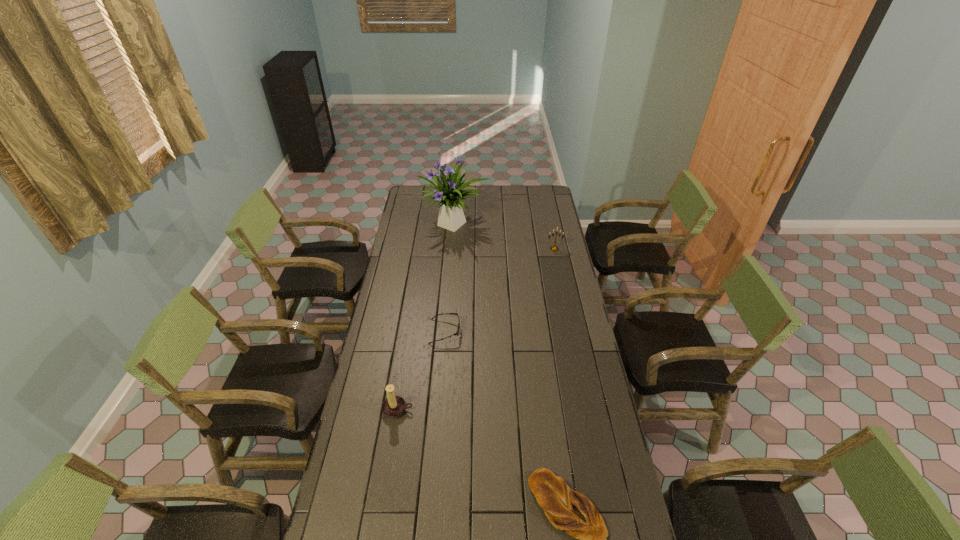
Where is `flower arrangement`? The image size is (960, 540). flower arrangement is located at coordinates (450, 192).

Locate an element on the screen. the second nearest object is located at coordinates (393, 406).

In order to click on the nearer candelabrum in this screenshot , I will do `click(393, 406)`.

Locate an element on the screen. Image resolution: width=960 pixels, height=540 pixels. the farther candelabrum is located at coordinates (553, 248).

The width and height of the screenshot is (960, 540). What are the coordinates of `sunglasses` in the screenshot? It's located at (458, 330).

Identify the location of vacant position located 0.080m on the front of the tallest object. The height and width of the screenshot is (540, 960). (453, 255).

You are a GUI agent. You are given a task and a screenshot of the screen. Output one action in this format:
    pyautogui.click(x=<x>, y=<y>)
    Task: Click on the free location located 0.350m on the wick of the second nearest object
    This screenshot has height=540, width=960.
    Given the screenshot: What is the action you would take?
    pyautogui.click(x=380, y=524)

Find the location of a particular element. This screenshot has width=960, height=540. vacant region located on the front of the farther candelabrum is located at coordinates (557, 260).

Locate an element on the screen. This screenshot has height=540, width=960. vacant area situated 0.110m on the front-facing side of the sunglasses is located at coordinates (485, 332).

You are a GUI agent. You are given a task and a screenshot of the screen. Output one action in this format:
    pyautogui.click(x=<x>, y=<y>)
    Task: Click on the flower arrangement that is at the left edge
    The width and height of the screenshot is (960, 540).
    Given the screenshot: What is the action you would take?
    pyautogui.click(x=450, y=192)